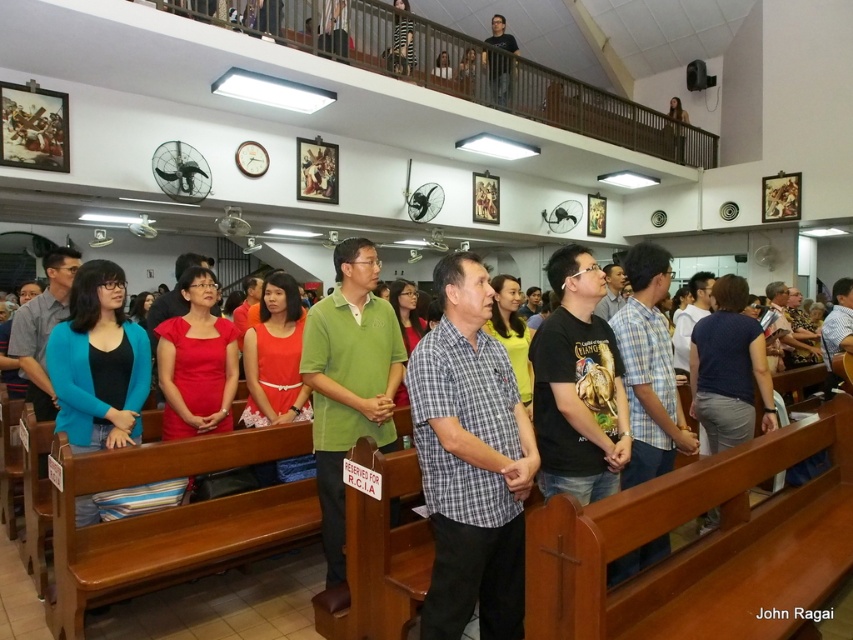
You are a photographer taking a picture of the group in the church. You want to ensure that both the gray checkered shirt at center and the black matte shirt at upper center are clearly visible in the photo. Which shirt should you focus on first to ensure both are in focus?

The gray checkered shirt at center is below the black matte shirt at upper center. To ensure both are in focus, you should focus on the black matte shirt at upper center first since it is farther away, allowing the gray checkered shirt at center to be within the depth of field.

You are a photographer taking a picture of the group in the church. You want to ensure both the green matte shirt at center and the black matte shirt at upper center are clearly visible. Considering their sizes, which shirt should you focus on to ensure it stands out more in the photo?

The green matte shirt at center is bigger than the black matte shirt at upper center, so focusing on the green matte shirt at center will make it stand out more in the photo due to its larger size.